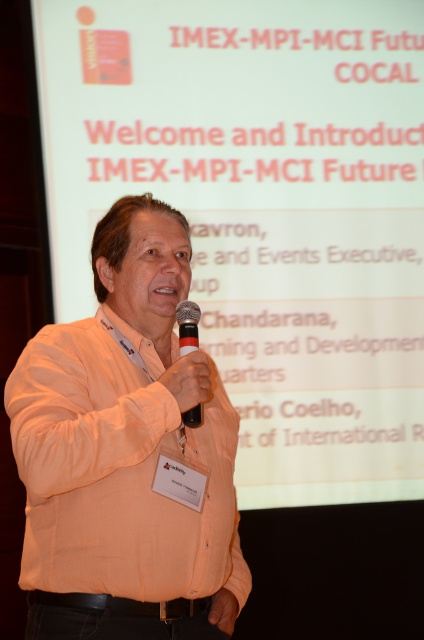
Who is positioned more to the left, orange shirt at center or black matte microphone at center?

black matte microphone at center is more to the left.

Can you confirm if orange shirt at center is thinner than black matte microphone at center?

Incorrect, orange shirt at center's width is not less than black matte microphone at center's.

Describe the element at coordinates (262, 211) in the screenshot. I see `orange shirt at center` at that location.

You are a GUI agent. You are given a task and a screenshot of the screen. Output one action in this format:
    pyautogui.click(x=<x>, y=<y>)
    Task: Click on the orange shirt at center
    The height and width of the screenshot is (640, 424).
    Given the screenshot: What is the action you would take?
    pyautogui.click(x=262, y=211)

Can you confirm if orange shirt at center is bigger than orange cotton shirt at center?

Indeed, orange shirt at center has a larger size compared to orange cotton shirt at center.

Does point (195, 234) lie in front of point (109, 572)?

No, (195, 234) is further to viewer.

The image size is (424, 640). Identify the location of orange shirt at center. (262, 211).

Locate an element on the screen. Image resolution: width=424 pixels, height=640 pixels. orange shirt at center is located at coordinates (262, 211).

Does orange cotton shirt at center have a lesser height compared to black matte microphone at center?

In fact, orange cotton shirt at center may be taller than black matte microphone at center.

Identify the location of orange cotton shirt at center. This screenshot has width=424, height=640. (127, 454).